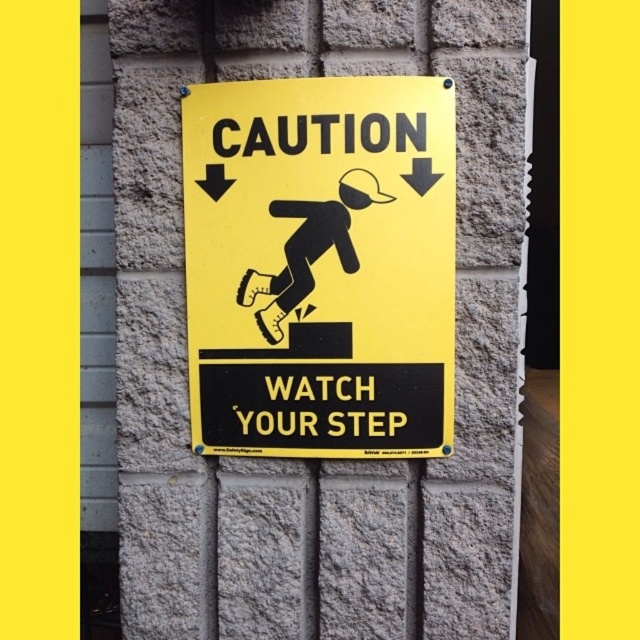
You are standing in front of the caution sign and want to touch both the yellow matte sign at center and the black matte figure at center. Which object will you touch first?

The yellow matte sign at center is closer to the viewer than the black matte figure at center, so you will touch the yellow matte sign at center first.

You are standing 5 feet away from the yellow matte sign at center. If you take a step forward, will you be closer than 3 feet to it?

The yellow matte sign at center is 3.76 feet away. If you take a step forward, you will be 3.76 minus the step length. Assuming a typical step is about 2.5 feet, you would be 1.26 feet away, which is closer than 3 feet. So yes, you will be closer than 3 feet.

You are an interior designer assessing the placement of the yellow matte sign at center and the black matte figure at center. Which object has a greater width?

The yellow matte sign at center might be wider than black matte figure at center according to the description.